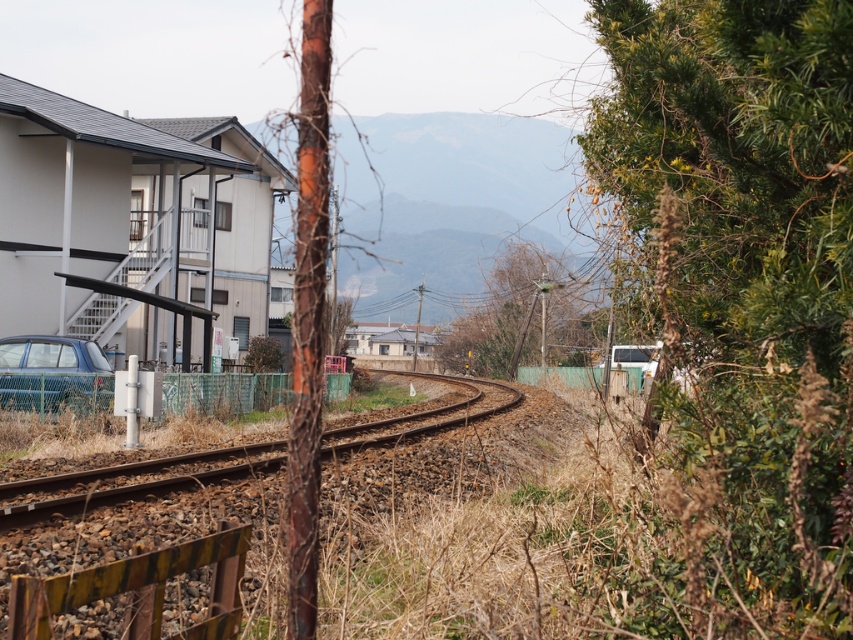
You are an artist sketching the scene and want to emphasize the contrast between the bare branches at center and the brown gravel track at center. Which object should you draw first to establish the scale and proportion of the scene?

The bare branches at center is larger in size than the brown gravel track at center, so you should draw the bare branches at center first to establish the scale and proportion of the scene.

Based on the photo, you are a photographer standing at the center of the railway track. You want to take a picture of the matte blue hatchback at lower left and the bare branches at center in the same frame. Considering their distances from your position, will both objects appear in the same photo?

The bare branches at center is 101.69 feet away from matte blue hatchback at lower left. Since the photographer is at the center of the railway track, both objects are positioned such that their distance apart is 101.69 feet. Depending on the camera lens used, if the field of view can capture a span of over 100 feet, then both the matte blue hatchback at lower left and the bare branches at center can be included in the same photo.

You are a photographer standing at the camera position. You want to capture a closeup shot of the bare branches at center. Given that your camera can focus on objects within 10 meters, will you be able to take the photo without moving closer?

The distance between the bare branches at center and the camera is 9.01 meters, which is within the camera focus range of 10 meters. Therefore, you can take the photo without moving closer.